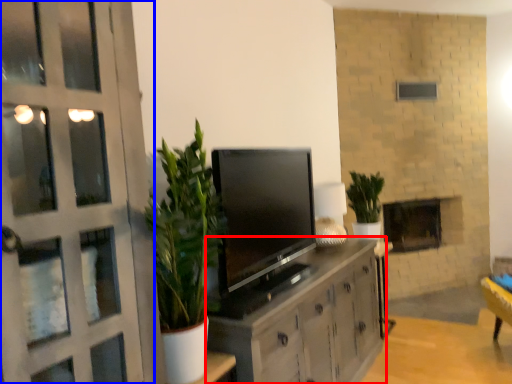
Question: Which object appears closest to the camera in this image, cabinetry (highlighted by a red box) or door (highlighted by a blue box)?

Choices:
 (A) cabinetry
 (B) door

Answer: (B)